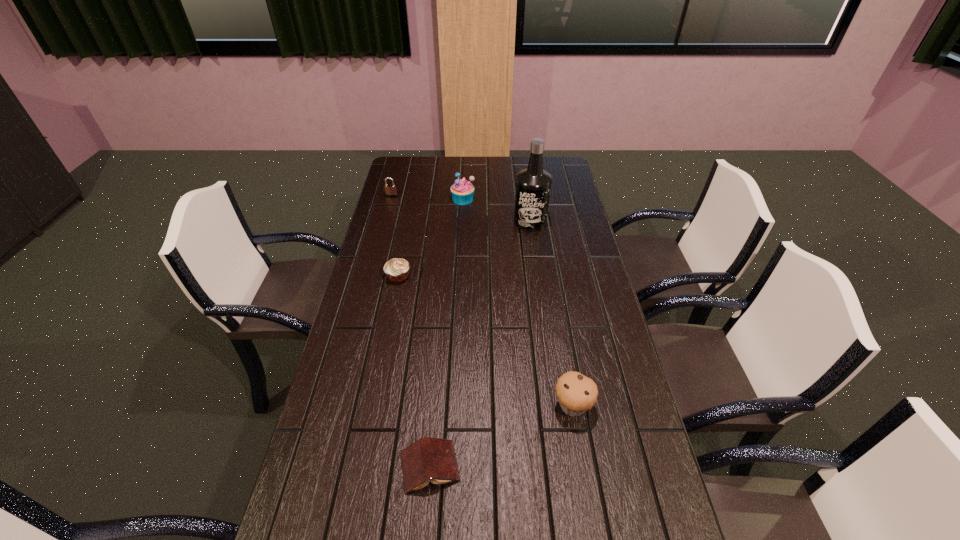
What are the coordinates of `vacant region that satisfies the following two spatial constraints: 1. on the front label of the fifth farthest object; 2. on the right side of the fourth nearest object` in the screenshot? It's located at coord(556,406).

Locate an element on the screen. This screenshot has height=540, width=960. vacant space that satisfies the following two spatial constraints: 1. on the front side of the rightmost muffin; 2. on the right side of the leftmost object is located at coordinates (335, 406).

At what (x,y) coordinates should I click in order to perform the action: click on vacant space that satisfies the following two spatial constraints: 1. on the front label of the tallest object; 2. on the left side of the second nearest object. Please return your answer as a coordinate pair (x, y). Looking at the image, I should click on (556, 406).

Image resolution: width=960 pixels, height=540 pixels. Find the location of `vacant area in the image that satisfies the following two spatial constraints: 1. on the back side of the farthest muffin; 2. on the right side of the shortest object`. vacant area in the image that satisfies the following two spatial constraints: 1. on the back side of the farthest muffin; 2. on the right side of the shortest object is located at coordinates (x=452, y=199).